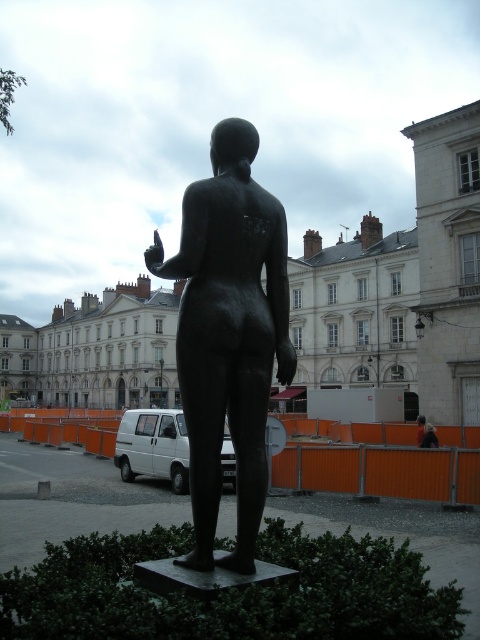
Question: From the image, what is the correct spatial relationship of bronze statue at center in relation to blurred fabric woman at center?

Choices:
 (A) above
 (B) below

Answer: (A)

Question: Which point is closer to the camera?

Choices:
 (A) bronze statue at center
 (B) blurred fabric woman at center

Answer: (A)

Question: Where is bronze statue at center located in relation to blurred fabric woman at center in the image?

Choices:
 (A) above
 (B) below

Answer: (A)

Question: Is bronze statue at center to the right of blurred fabric woman at center from the viewer's perspective?

Choices:
 (A) no
 (B) yes

Answer: (A)

Question: Which object is farther from the camera taking this photo?

Choices:
 (A) bronze statue at center
 (B) blurred fabric woman at center

Answer: (B)